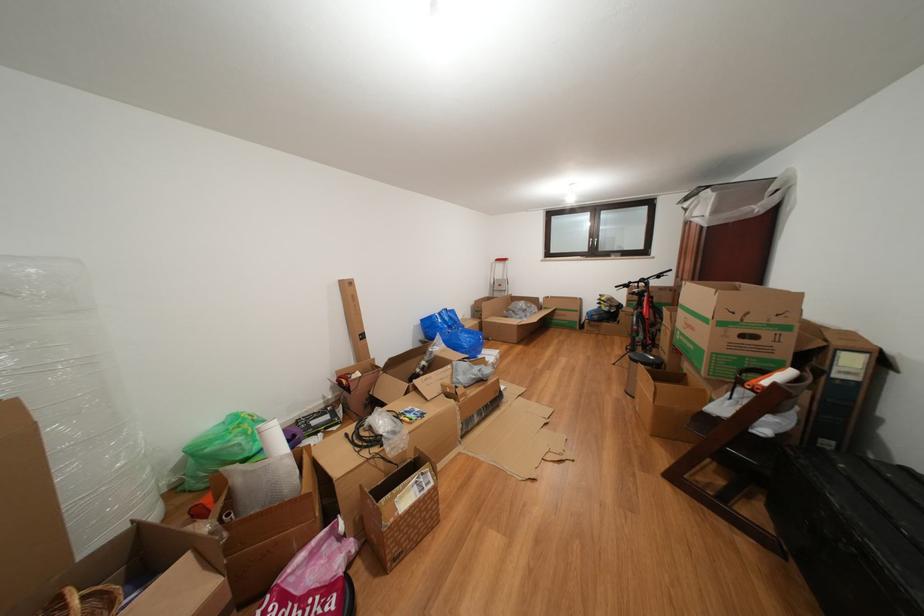
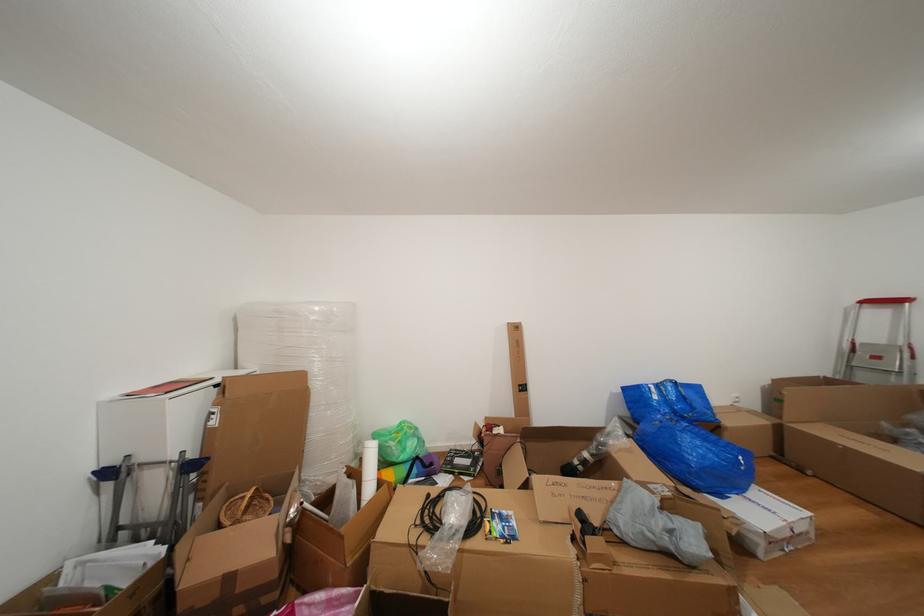
Question: How did the camera likely rotate?

Choices:
 (A) Left
 (B) Right
 (C) Up
 (D) Down

Answer: (A)